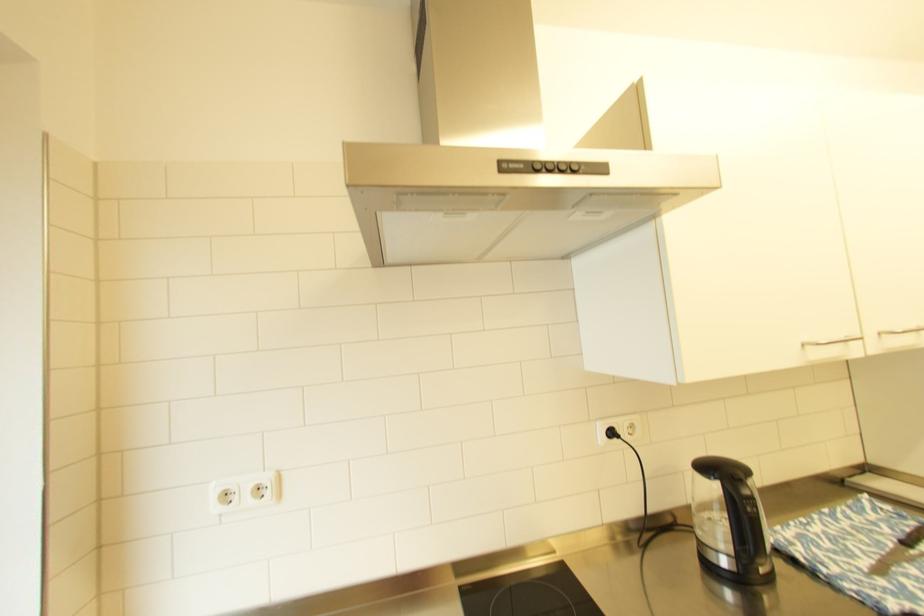
What do you see at coordinates (728, 477) in the screenshot? This screenshot has height=616, width=924. I see `the black kettle handle` at bounding box center [728, 477].